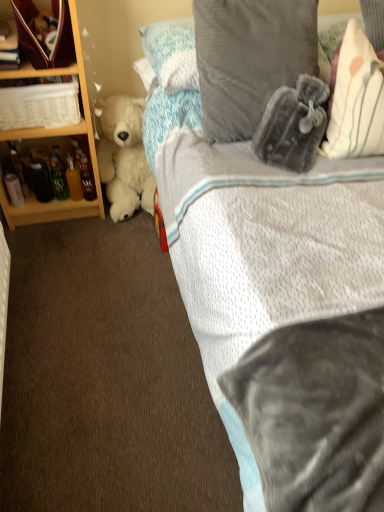
Question: Is white plastic basket at left oriented away from white plush teddy bear at left?

Choices:
 (A) no
 (B) yes

Answer: (A)

Question: From the image's perspective, is white plastic basket at left on top of white plush teddy bear at left?

Choices:
 (A) no
 (B) yes

Answer: (B)

Question: Does white plastic basket at left appear on the left side of white plush teddy bear at left?

Choices:
 (A) no
 (B) yes

Answer: (B)

Question: Considering the relative sizes of white plastic basket at left and white plush teddy bear at left in the image provided, is white plastic basket at left bigger than white plush teddy bear at left?

Choices:
 (A) no
 (B) yes

Answer: (A)

Question: Considering the relative sizes of white plastic basket at left and white plush teddy bear at left in the image provided, is white plastic basket at left smaller than white plush teddy bear at left?

Choices:
 (A) yes
 (B) no

Answer: (A)

Question: From the image's perspective, is white plastic basket at left beneath white plush teddy bear at left?

Choices:
 (A) no
 (B) yes

Answer: (A)

Question: Does matte glass bottle at left appear on the right side of velvety gray pillow at upper right?

Choices:
 (A) no
 (B) yes

Answer: (A)

Question: From a real-world perspective, is matte glass bottle at left positioned under velvety gray pillow at upper right based on gravity?

Choices:
 (A) yes
 (B) no

Answer: (A)

Question: Is matte glass bottle at left not near velvety gray pillow at upper right?

Choices:
 (A) no
 (B) yes

Answer: (B)

Question: Could you tell me if matte glass bottle at left is facing velvety gray pillow at upper right?

Choices:
 (A) no
 (B) yes

Answer: (A)

Question: Considering the relative sizes of matte glass bottle at left and velvety gray pillow at upper right in the image provided, is matte glass bottle at left smaller than velvety gray pillow at upper right?

Choices:
 (A) no
 (B) yes

Answer: (B)

Question: Can you confirm if matte glass bottle at left is taller than velvety gray pillow at upper right?

Choices:
 (A) no
 (B) yes

Answer: (A)

Question: Can you confirm if velvet maroon bag at upper left is thinner than matte glass bottle at left?

Choices:
 (A) yes
 (B) no

Answer: (B)